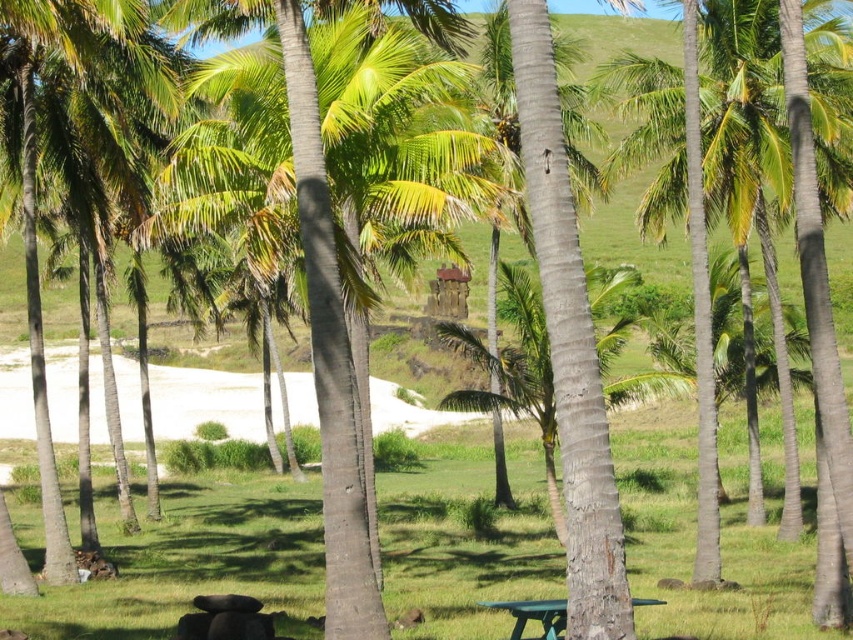
Question: Which of the following is the farthest from the observer?

Choices:
 (A) (360, 598)
 (B) (531, 609)

Answer: (B)

Question: Which point is closer to the camera?

Choices:
 (A) (375, 616)
 (B) (548, 611)

Answer: (A)

Question: Is green leafy palm tree at center bigger than green plastic picnic table at lower center?

Choices:
 (A) yes
 (B) no

Answer: (A)

Question: Can you confirm if green leafy palm tree at center is positioned above green plastic picnic table at lower center?

Choices:
 (A) yes
 (B) no

Answer: (A)

Question: Is green leafy palm tree at center wider than green plastic picnic table at lower center?

Choices:
 (A) yes
 (B) no

Answer: (A)